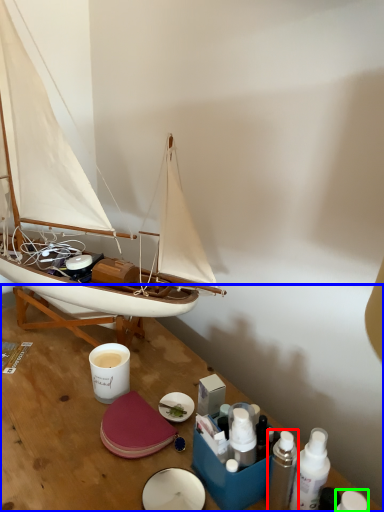
Question: Which object is the farthest from toiletry (highlighted by a red box)? Choose among these: table (highlighted by a blue box) or toiletry (highlighted by a green box).

Choices:
 (A) table
 (B) toiletry

Answer: (A)